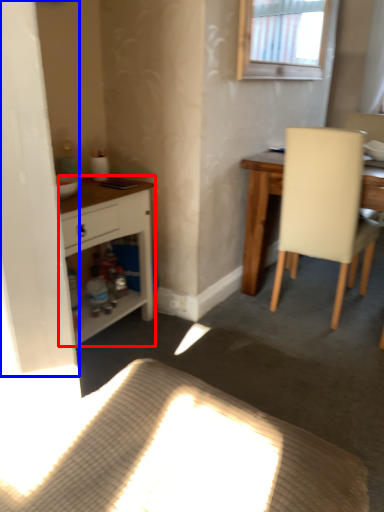
Question: Among these objects, which one is farthest to the camera, cabinetry (highlighted by a red box) or screen door (highlighted by a blue box)?

Choices:
 (A) cabinetry
 (B) screen door

Answer: (A)